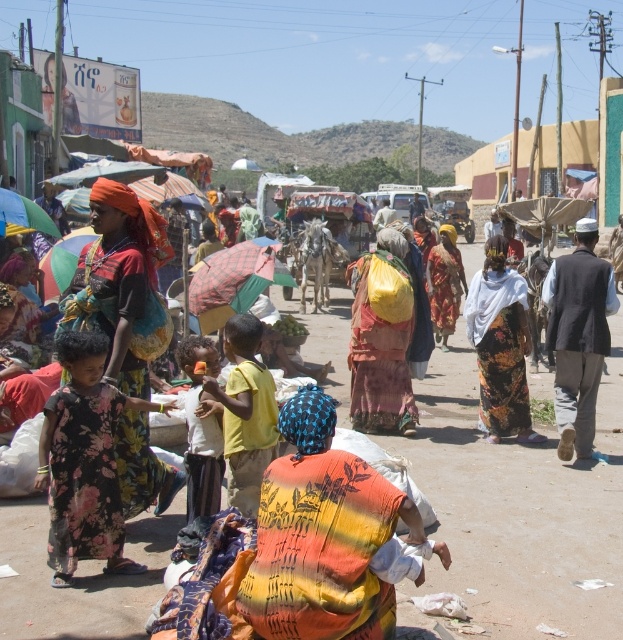
You are a photographer trying to capture a photo of the floral fabric dress at center and the checkered fabric umbrella at center. Since the dress is taller than the umbrella, how should you position your camera to ensure both are fully visible in the frame?

The floral fabric dress at center is taller than the checkered fabric umbrella at center, so you should position your camera at a lower angle to capture the full height of the dress while still including the umbrella in the frame.

You are standing at the center of the market and see a floral fabric dress at center. Is there any object at the point with coordinates (500, 346)?

Yes, at point (500, 346) there is a floral fabric dress at center.